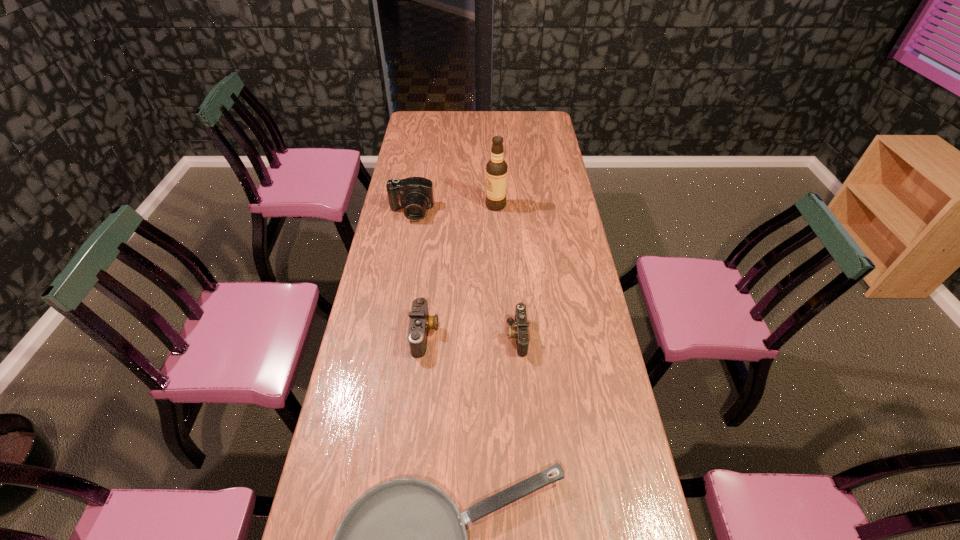
The width and height of the screenshot is (960, 540). In order to click on camera that is the third closest to the frying pan in this screenshot , I will do `click(415, 194)`.